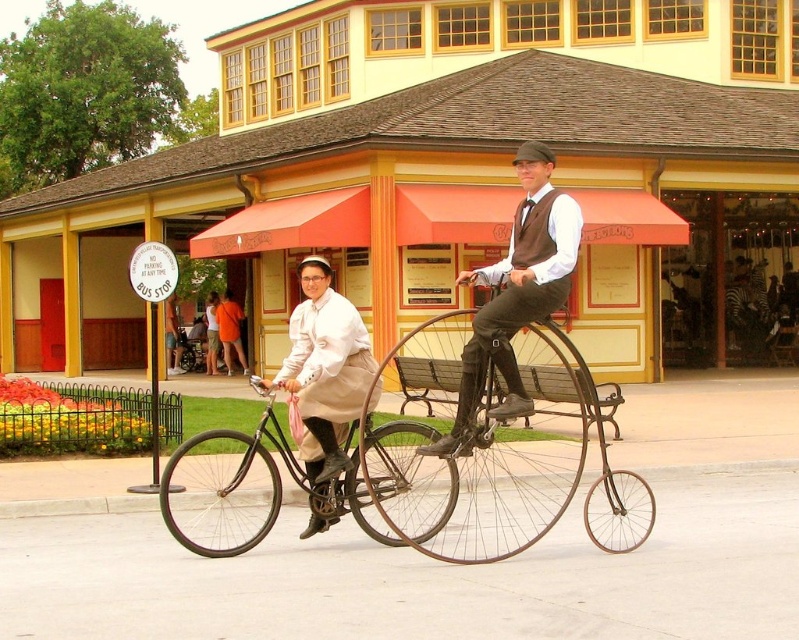
I want to click on black matte bicycle at center, so click(243, 488).

Between black matte bicycle at center and orange cotton dress at center, which one appears on the left side from the viewer's perspective?

orange cotton dress at center

Image resolution: width=799 pixels, height=640 pixels. What are the coordinates of `black matte bicycle at center` in the screenshot? It's located at (243, 488).

Does orange cotton dress at center have a larger size compared to orange fabric dress at center?

No.

Can you confirm if orange cotton dress at center is taller than orange fabric dress at center?

No, orange cotton dress at center is not taller than orange fabric dress at center.

Does point (225, 330) lie behind point (209, 291)?

No, it is not.

The height and width of the screenshot is (640, 799). Find the location of `orange cotton dress at center`. orange cotton dress at center is located at coordinates (229, 326).

Does black matte bicycle at center appear under orange fabric dress at center?

Yes.

Does black matte bicycle at center have a smaller size compared to orange fabric dress at center?

Indeed, black matte bicycle at center has a smaller size compared to orange fabric dress at center.

Does point (193, 467) lie in front of point (209, 371)?

Yes.

Where is `black matte bicycle at center`? black matte bicycle at center is located at coordinates (243, 488).